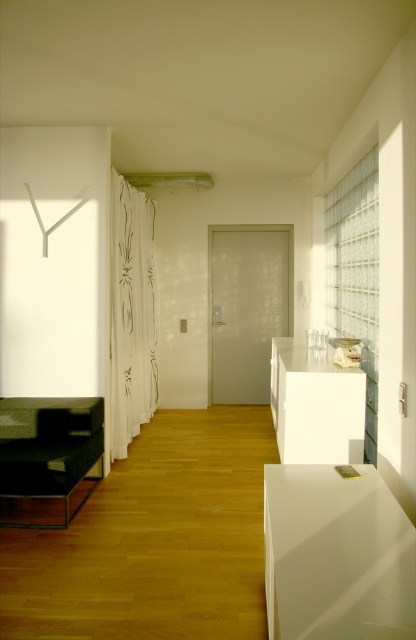
You are moving a large painting that is 1.5 meters wide. You want to place it on the wall between the white glossy cabinet at lower right and the white glossy cabinet at center. Is there enough space between them for the painting?

The white glossy cabinet at lower right is in front of the white glossy cabinet at center, so there is no space between them to place the painting.